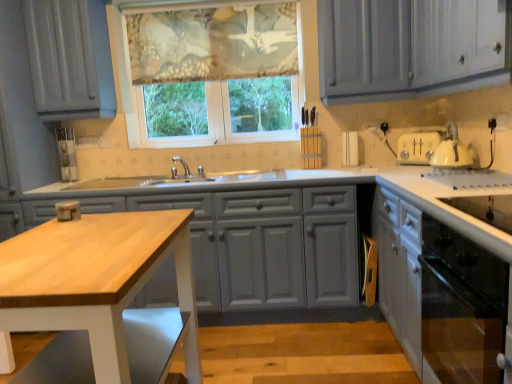
This screenshot has height=384, width=512. Identify the location of blank space above wooden table at center (from a real-world perspective). (105, 242).